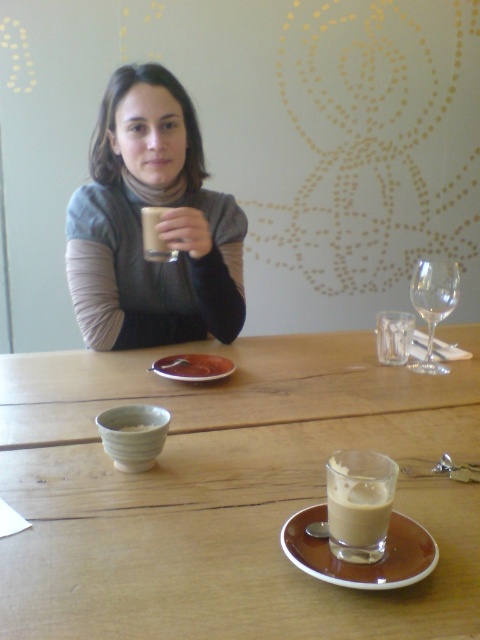
Who is more distant from viewer, (194, 150) or (419, 292)?

The point (194, 150) is behind.

Can you confirm if matte gray sweater at upper center is smaller than transparent glass wine glass at right?

Result: Actually, matte gray sweater at upper center might be larger than transparent glass wine glass at right.

Is point (194, 317) positioned behind point (440, 364)?

That is True.

Identify the location of matte gray sweater at upper center. (159, 228).

From the picture: Does wooden table at center have a lesser height compared to matte gray sweater at upper center?

Yes.

Does wooden table at center appear under matte gray sweater at upper center?

Yes, wooden table at center is below matte gray sweater at upper center.

Who is more distant from viewer, (x=374, y=621) or (x=224, y=301)?

The point (x=224, y=301) is more distant.

This screenshot has height=640, width=480. I want to click on wooden table at center, so click(x=227, y=492).

Is point (448, 529) positioned before point (359, 557)?

No, (448, 529) is behind (359, 557).

Between point (463, 592) and point (351, 481), which one is positioned behind?

Positioned behind is point (351, 481).

In order to click on wooden table at center in this screenshot , I will do `click(227, 492)`.

This screenshot has width=480, height=640. Find the location of `wooden table at center`. wooden table at center is located at coordinates (227, 492).